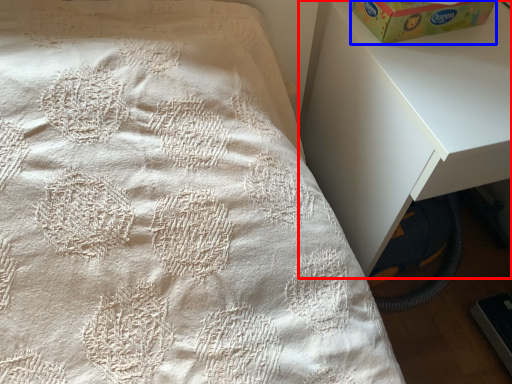
Question: Which object appears farthest to the camera in this image, nightstand (highlighted by a red box) or box (highlighted by a blue box)?

Choices:
 (A) nightstand
 (B) box

Answer: (B)